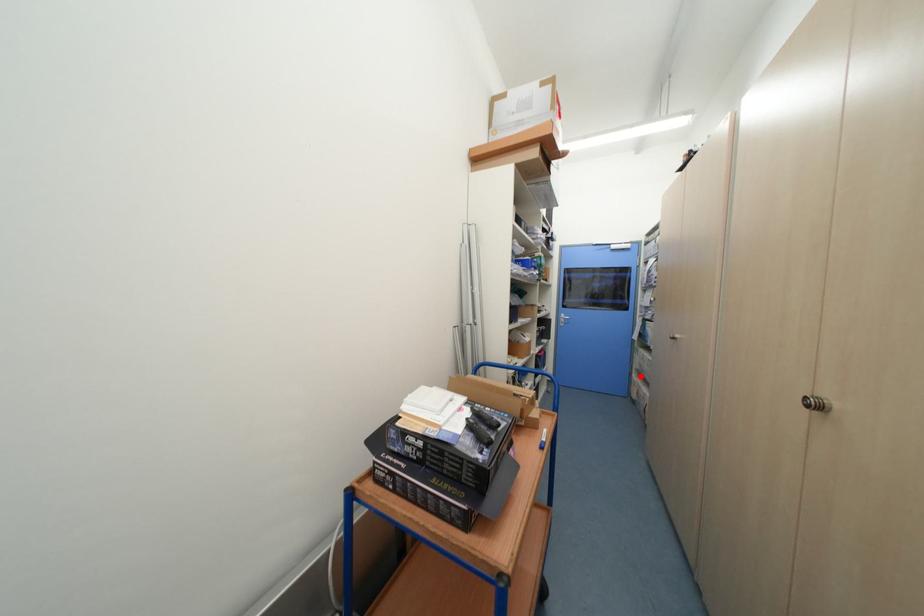
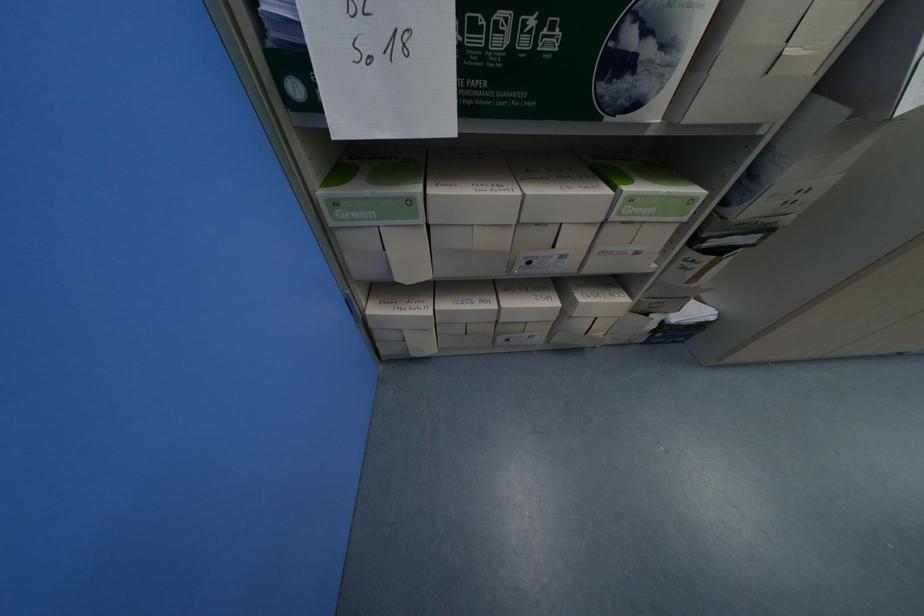
The point at the highlighted location is marked in the first image. Where is the corresponding point in the second image?

(381, 312)